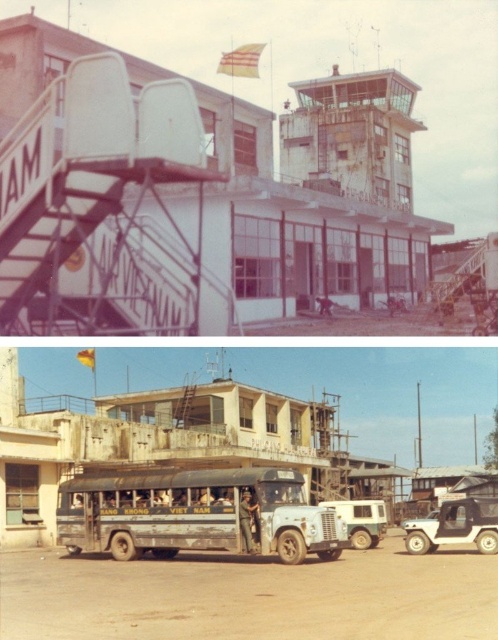
Who is more forward, (438, 625) or (432, 550)?

Point (438, 625) is more forward.

From the picture: Can you confirm if brown dusty ground at lower center is positioned below white matte jeep at lower right?

Incorrect, brown dusty ground at lower center is not positioned below white matte jeep at lower right.

Locate an element on the screen. Image resolution: width=498 pixels, height=640 pixels. brown dusty ground at lower center is located at coordinates (250, 596).

Is point (466, 563) positioned after point (165, 529)?

No, it is in front of (165, 529).

Between brown dusty ground at lower center and dirty green bus at center, which one is positioned lower?

Positioned lower is brown dusty ground at lower center.

Does point (227, 618) lie in front of point (145, 508)?

Yes, it is.

Find the location of `brown dusty ground at lower center`. brown dusty ground at lower center is located at coordinates (250, 596).

Who is positioned more to the right, brown dusty ground at lower center or white matte van at center?

white matte van at center

Can you confirm if brown dusty ground at lower center is positioned below white matte van at center?

No, brown dusty ground at lower center is not below white matte van at center.

The width and height of the screenshot is (498, 640). Describe the element at coordinates (250, 596) in the screenshot. I see `brown dusty ground at lower center` at that location.

This screenshot has height=640, width=498. Find the location of `brown dusty ground at lower center`. brown dusty ground at lower center is located at coordinates (250, 596).